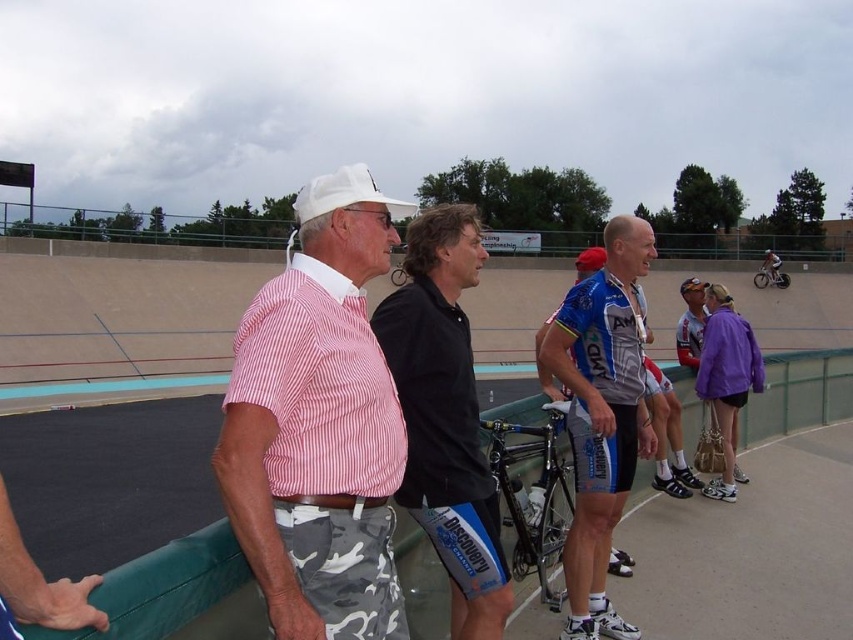
Question: Does pink striped shirt at center appear under black jersey at center?

Choices:
 (A) no
 (B) yes

Answer: (A)

Question: Among these points, which one is nearest to the camera?

Choices:
 (A) (373, 506)
 (B) (639, 312)

Answer: (A)

Question: Can you confirm if pink striped shirt at center is positioned above black jersey at center?

Choices:
 (A) no
 (B) yes

Answer: (B)

Question: Which point is farther to the camera?

Choices:
 (A) blue jersey at center
 (B) pink striped shirt at center
 (C) black jersey at center

Answer: (A)

Question: Does pink striped shirt at center appear under black jersey at center?

Choices:
 (A) no
 (B) yes

Answer: (A)

Question: Among these objects, which one is farthest from the camera?

Choices:
 (A) black jersey at center
 (B) pink striped shirt at center

Answer: (A)